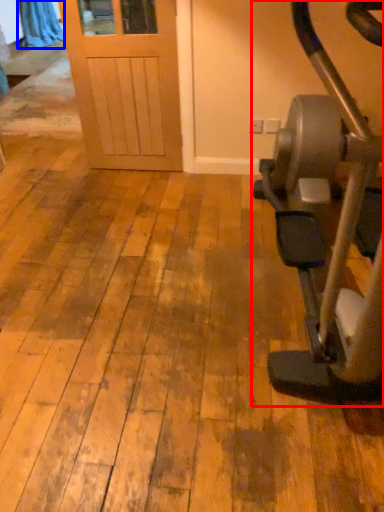
Question: Which point is further to the camera, stationary bicycle (highlighted by a red box) or curtain (highlighted by a blue box)?

Choices:
 (A) stationary bicycle
 (B) curtain

Answer: (B)